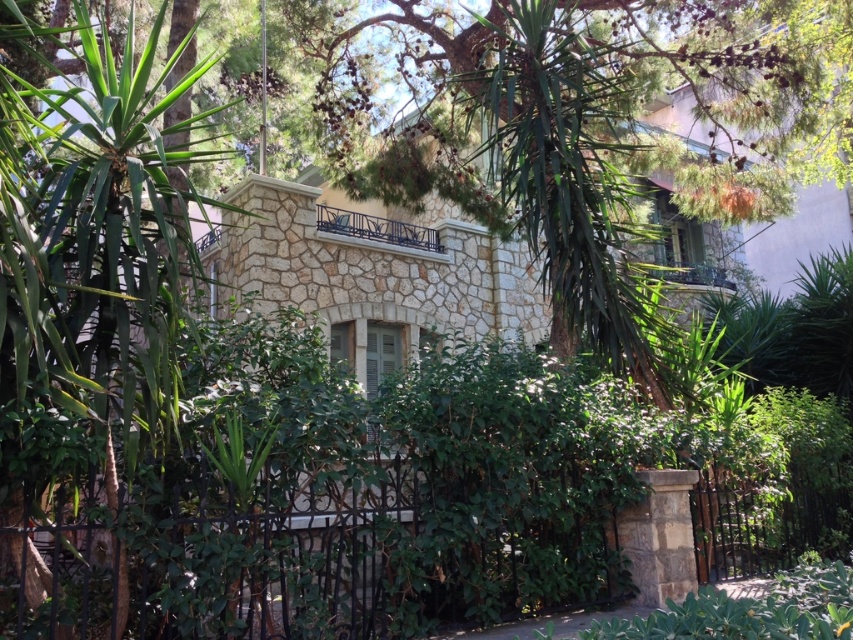
Is green leafy tree at center taller than iron/black at center?

No.

Which is in front, point (532, 182) or point (305, 554)?

Point (305, 554)

Identify the location of green leafy tree at center. (560, 128).